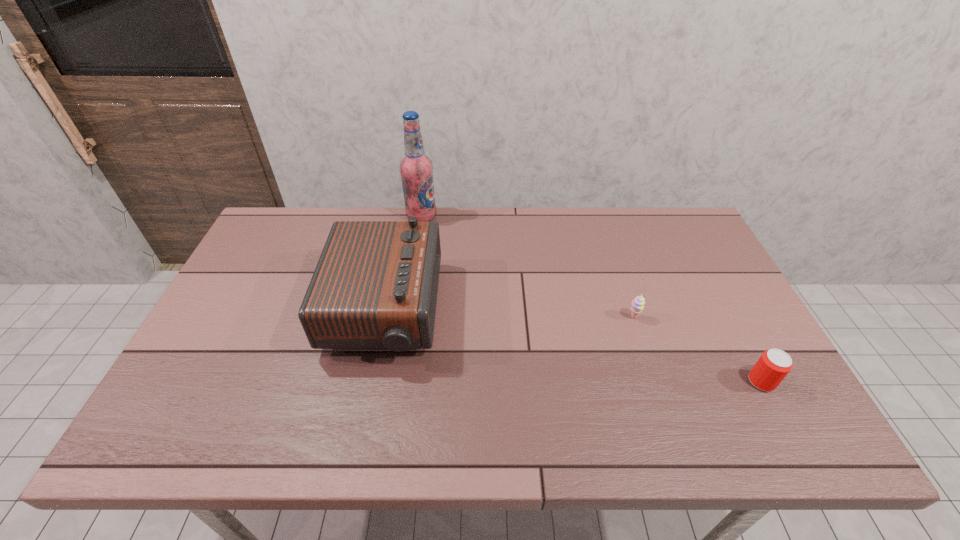
You are a GUI agent. You are given a task and a screenshot of the screen. Output one action in this format:
    pyautogui.click(x=<x>, y=<y>)
    Task: Click on the free space that is in between the rightmost object and the tallest object
    
    Given the screenshot: What is the action you would take?
    pyautogui.click(x=591, y=299)

Locate an element on the screen. The image size is (960, 540). free spot between the sherbert and the beer can is located at coordinates (697, 349).

I want to click on free spot between the sherbert and the nearest object, so click(697, 349).

Image resolution: width=960 pixels, height=540 pixels. What are the coordinates of `free space between the radio receiver and the sherbert` in the screenshot? It's located at (509, 314).

Locate an element on the screen. The image size is (960, 540). free point between the radio receiver and the nearest object is located at coordinates (573, 346).

You are a GUI agent. You are given a task and a screenshot of the screen. Output one action in this format:
    pyautogui.click(x=<x>, y=<y>)
    Task: Click on the object identified as the third closest to the alcohol
    This screenshot has height=540, width=960.
    Given the screenshot: What is the action you would take?
    pyautogui.click(x=772, y=367)

Locate an element on the screen. object identified as the second closest to the radio receiver is located at coordinates (638, 303).

The height and width of the screenshot is (540, 960). I want to click on free region that satisfies the following two spatial constraints: 1. on the tuning display of the rightmost object; 2. on the right side of the second tallest object, so click(x=370, y=382).

Identify the location of vacant position in the image that satisfies the following two spatial constraints: 1. on the tuning display of the second tallest object; 2. on the left side of the second object from right to left. (383, 318).

Find the location of a particular element. free spot that satisfies the following two spatial constraints: 1. on the front side of the alcohol; 2. on the tuning display of the radio receiver is located at coordinates (407, 310).